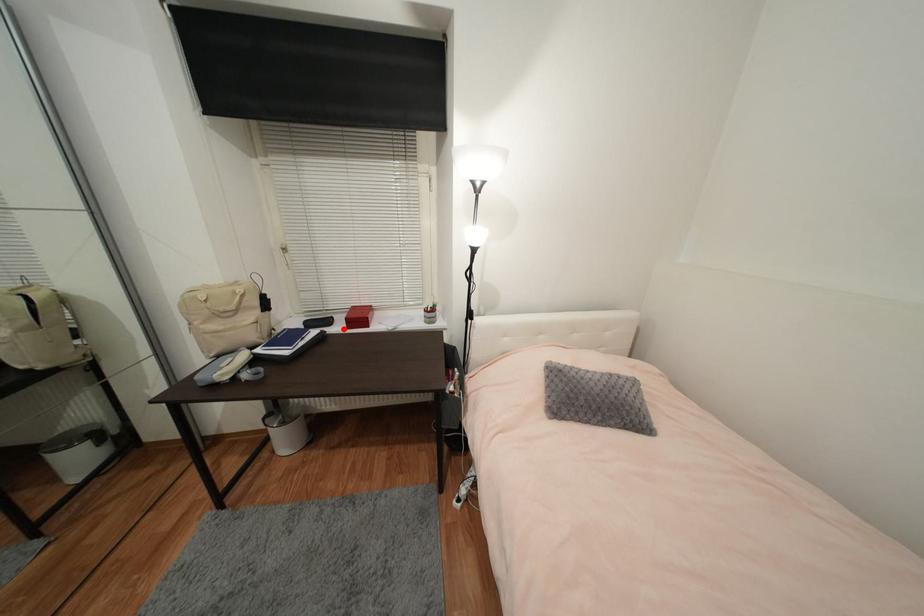
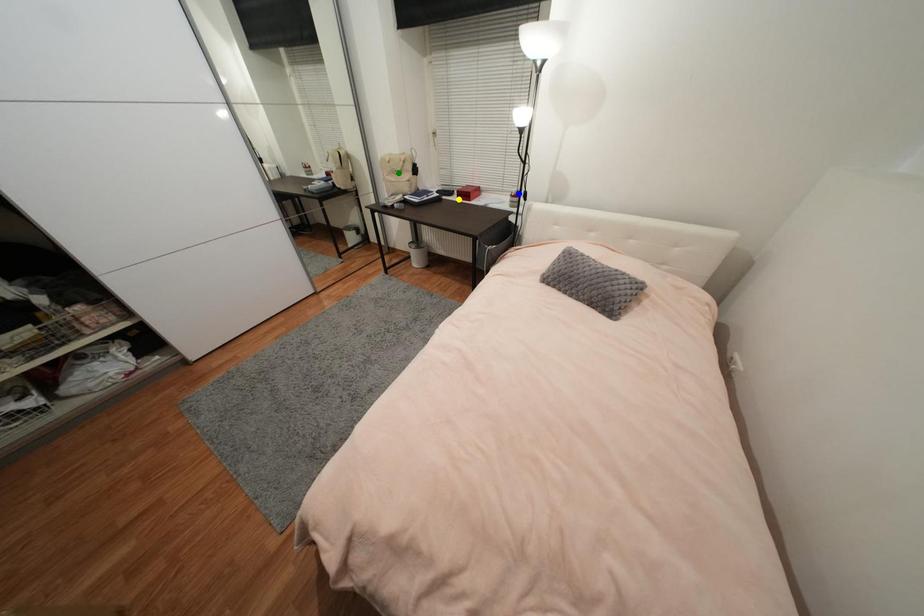
Question: I am providing you with two images of the same scene from different viewpoints. A red point is marked on the first image. You are given multiple points on the second image. Which point in image 2 represents the same 3d spot as the red point in image 1?

Choices:
 (A) blue point
 (B) green point
 (C) yellow point

Answer: (C)